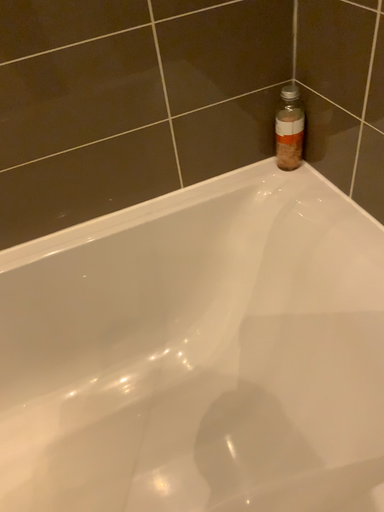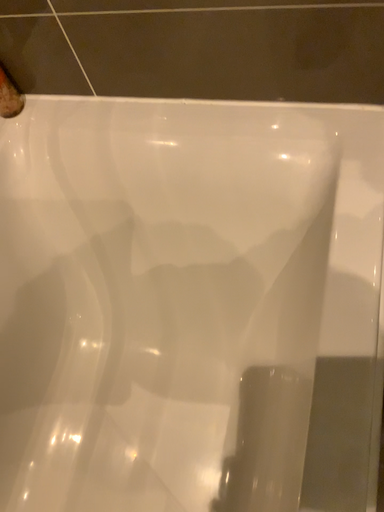
Question: How did the camera likely rotate when shooting the video?

Choices:
 (A) rotated right
 (B) rotated left

Answer: (A)